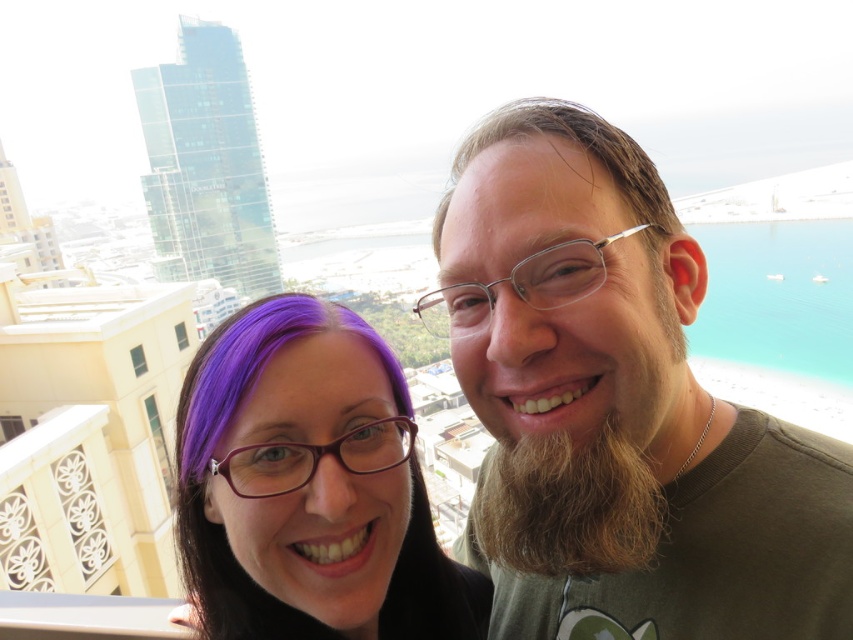
Does brown fuzzy beard at right have a lesser width compared to brown matte hair at upper center?

Yes, brown fuzzy beard at right is thinner than brown matte hair at upper center.

Who is taller, brown fuzzy beard at right or brown matte hair at upper center?

brown matte hair at upper center

In order to click on brown fuzzy beard at right in this screenshot , I will do `click(567, 506)`.

You are a GUI agent. You are given a task and a screenshot of the screen. Output one action in this format:
    pyautogui.click(x=<x>, y=<y>)
    Task: Click on the brown fuzzy beard at right
    This screenshot has height=640, width=853.
    Given the screenshot: What is the action you would take?
    pyautogui.click(x=567, y=506)

Is purple hair at center thinner than brown fuzzy beard at right?

Incorrect, purple hair at center's width is not less than brown fuzzy beard at right's.

Which is above, purple hair at center or brown fuzzy beard at right?

purple hair at center

Does point (259, 422) come in front of point (573, 548)?

That is True.

Locate an element on the screen. This screenshot has height=640, width=853. purple hair at center is located at coordinates (309, 486).

What do you see at coordinates (618, 408) in the screenshot?
I see `brown matte shirt at right` at bounding box center [618, 408].

Does point (503, 337) come behind point (541, 124)?

No, (503, 337) is closer to viewer.

Between point (641, 419) and point (526, 106), which one is positioned behind?

Positioned behind is point (526, 106).

Where is `brown matte shirt at right`? This screenshot has height=640, width=853. brown matte shirt at right is located at coordinates (618, 408).